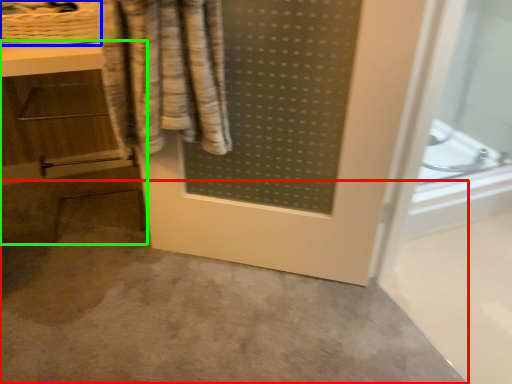
Question: Which object is the farthest from concrete (highlighted by a red box)? Choose among these: basket (highlighted by a blue box) or vanity (highlighted by a green box).

Choices:
 (A) basket
 (B) vanity

Answer: (A)